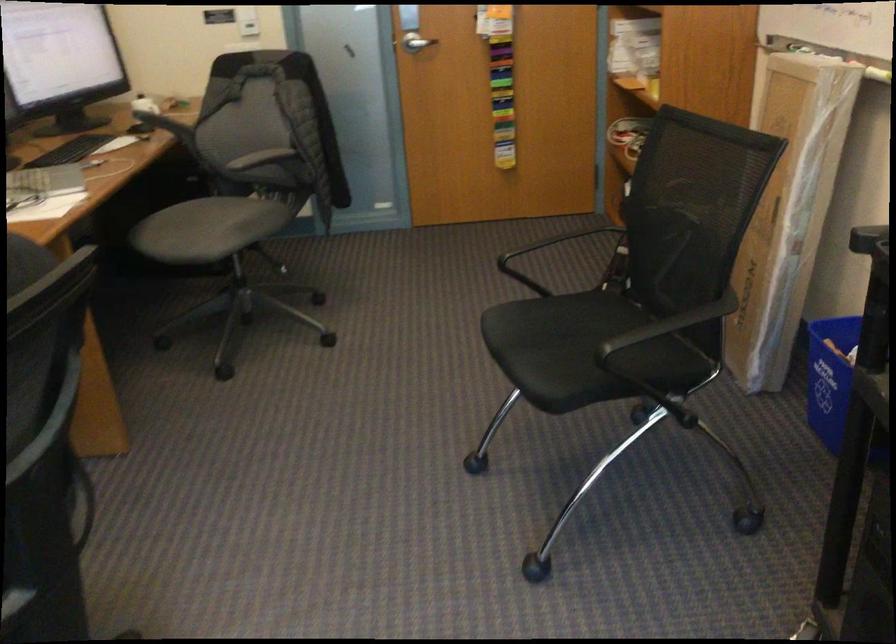
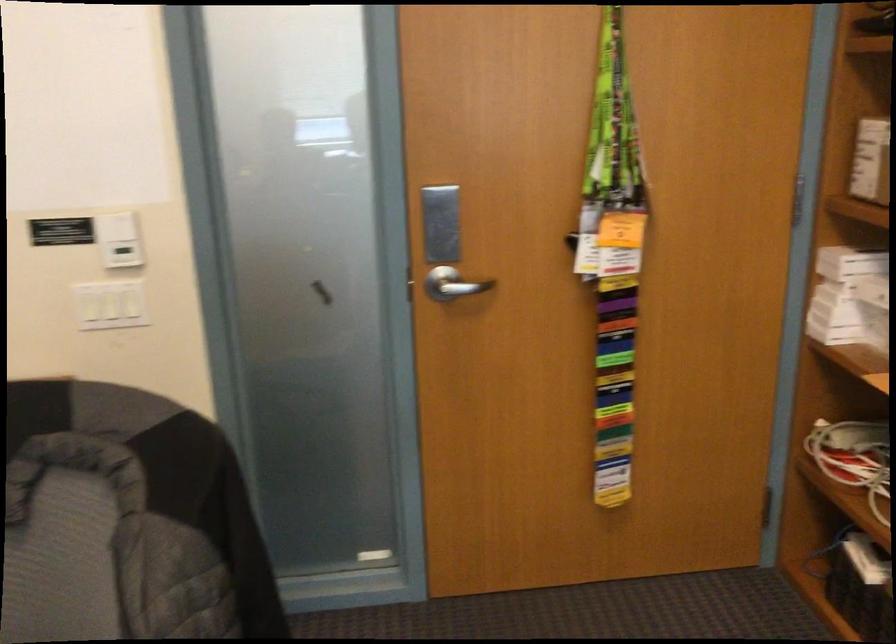
Question: Which direction would the cameraman need to move to produce the second image? Reply with the corresponding letter.

Choices:
 (A) Left
 (B) Right
 (C) Forward
 (D) Backward

Answer: (C)